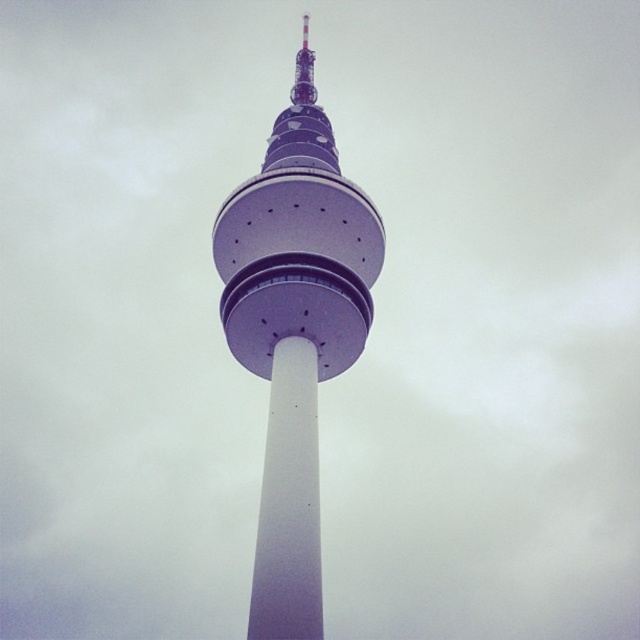
Question: Which point appears farthest from the camera in this image?

Choices:
 (A) (291, 628)
 (B) (340, 189)

Answer: (B)

Question: From the image, what is the correct spatial relationship of purple metallic tower at center in relation to white smooth pole at center?

Choices:
 (A) below
 (B) above

Answer: (B)

Question: Does purple metallic tower at center have a greater width compared to white smooth pole at center?

Choices:
 (A) no
 (B) yes

Answer: (B)

Question: Is purple metallic tower at center further to camera compared to white smooth pole at center?

Choices:
 (A) no
 (B) yes

Answer: (B)